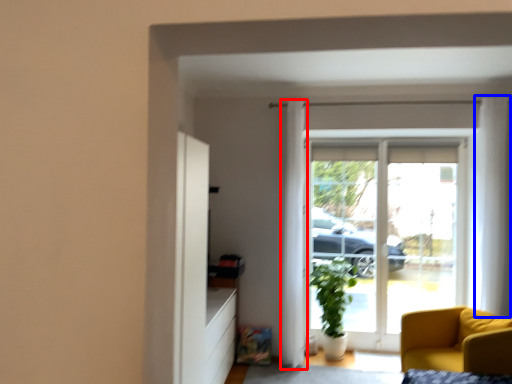
Question: Which point is closer to the camera, curtain (highlighted by a red box) or curtain (highlighted by a blue box)?

Choices:
 (A) curtain
 (B) curtain

Answer: (B)